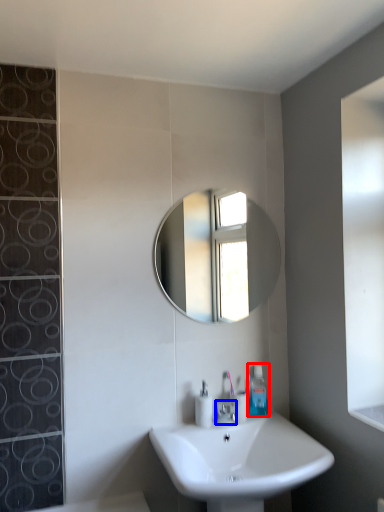
Question: Which point is further to the camera, toiletry (highlighted by a red box) or tap (highlighted by a blue box)?

Choices:
 (A) toiletry
 (B) tap

Answer: (A)